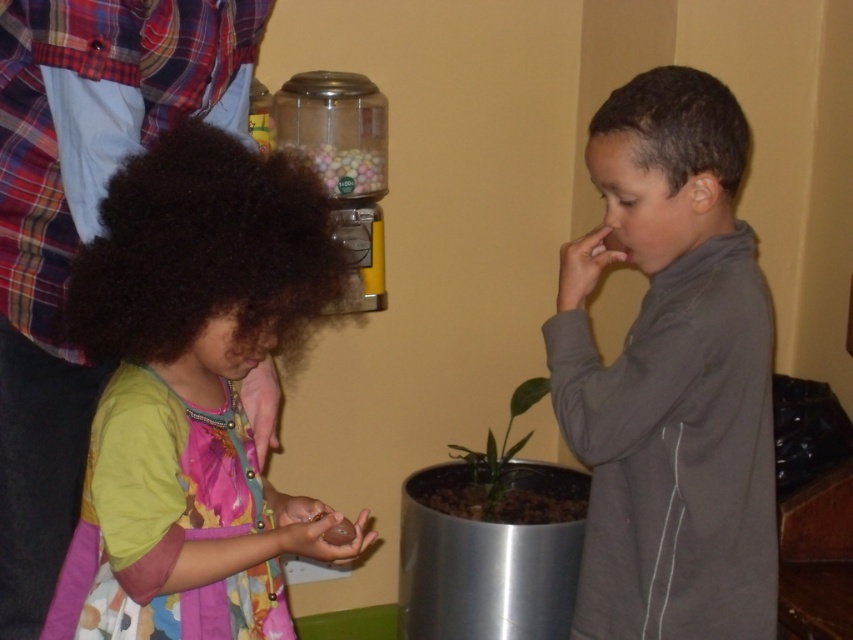
Is matte green dress at left wider than gray matte jacket at right?

Yes, matte green dress at left is wider than gray matte jacket at right.

Between point (314, 188) and point (706, 342), which one is positioned in front?

Positioned in front is point (314, 188).

What do you see at coordinates (193, 392) in the screenshot? I see `matte green dress at left` at bounding box center [193, 392].

Where is `matte green dress at left`? The height and width of the screenshot is (640, 853). matte green dress at left is located at coordinates (193, 392).

From the picture: Measure the distance from matte green dress at left to green leafy plant at center.

matte green dress at left and green leafy plant at center are 1.27 meters apart.

Between point (238, 301) and point (494, 513), which one is positioned in front?

Point (238, 301) is more forward.

Which is behind, point (357, 531) or point (467, 451)?

The point (467, 451) is more distant.

This screenshot has width=853, height=640. I want to click on matte green dress at left, so click(193, 392).

Is gray matte jacket at right taller than green leafy plant at center?

Yes, gray matte jacket at right is taller than green leafy plant at center.

Is gray matte jacket at right to the left of green leafy plant at center from the viewer's perspective?

In fact, gray matte jacket at right is to the right of green leafy plant at center.

Who is more distant from viewer, (656, 406) or (476, 472)?

The point (476, 472) is behind.

Identify the location of gray matte jacket at right. (670, 374).